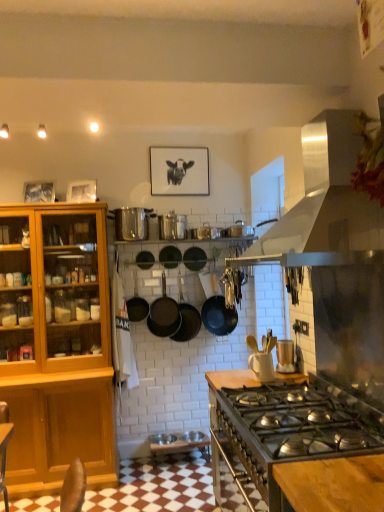
Question: Considering the positions of black matte picture frame at upper center and black matte wok at center, the first wok in the left-to-right sequence, in the image, is black matte picture frame at upper center wider or thinner than black matte wok at center, the first wok in the left-to-right sequence,?

Choices:
 (A) wide
 (B) thin

Answer: (B)

Question: Is black matte picture frame at upper center inside or outside of black matte wok at center, the second wok positioned from the right?

Choices:
 (A) outside
 (B) inside

Answer: (A)

Question: Estimate the real-world distances between objects in this image. Which object is closer to the wooden cutting board at center?

Choices:
 (A) black matte frying pan at center, the first frying pan positioned from the right
 (B) black matte frying pan at center, the third frying pan viewed from the right
 (C) metallic silver toaster at upper right, which ranks as the 4th appliance in back-to-front order
 (D) stainless steel range hood at upper right
 (E) black matte wok at center, the second wok positioned from the right

Answer: (C)

Question: Which object is the closest to the black matte wok at center, the second wok viewed from the left?

Choices:
 (A) wooden cutting board at center
 (B) matte black frying pan at center, positioned as the 2th frying pan in left-to-right order
 (C) black matte picture frame at upper center
 (D) stainless steel range hood at upper right
 (E) metallic silver pot at upper center, the 1th appliance when ordered from top to bottom

Answer: (B)